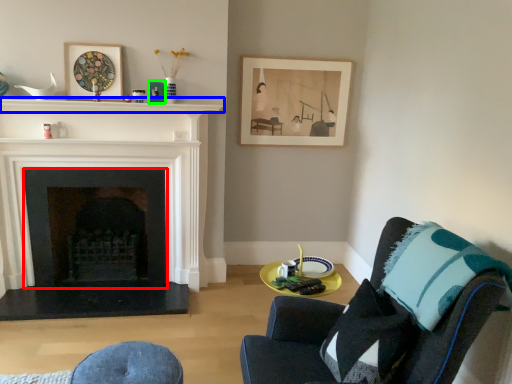
Question: Estimate the real-world distances between objects in this image. Which object is farther from fireplace (highlighted by a red box), mantle (highlighted by a blue box) or picture frame (highlighted by a green box)?

Choices:
 (A) mantle
 (B) picture frame

Answer: (B)